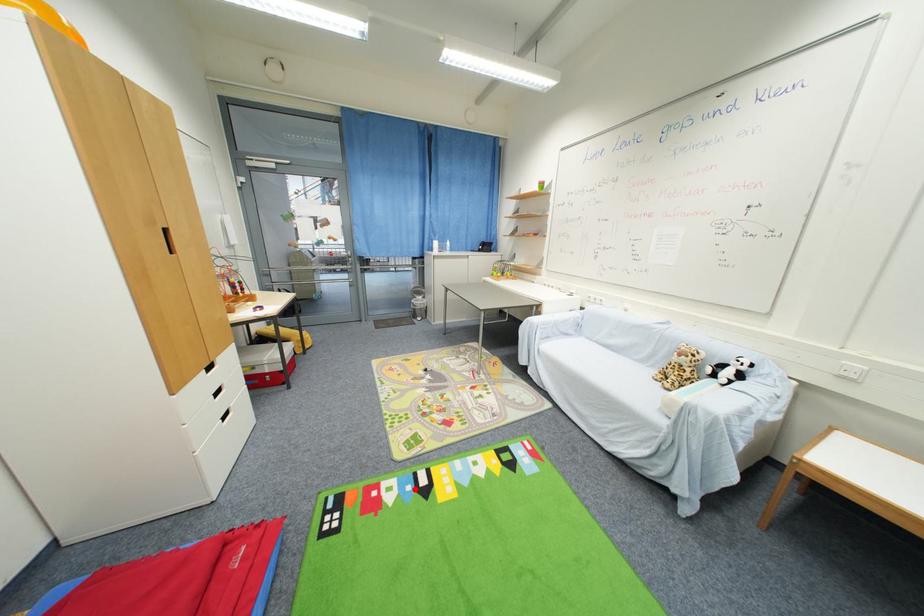
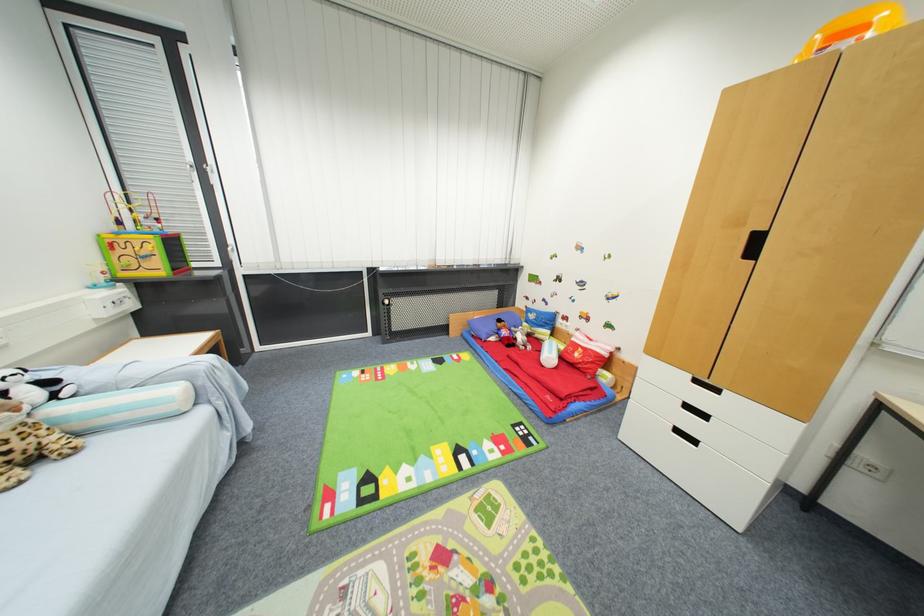
Locate, in the second image, the point that corresponds to the highlighted location in the first image.

(479, 455)